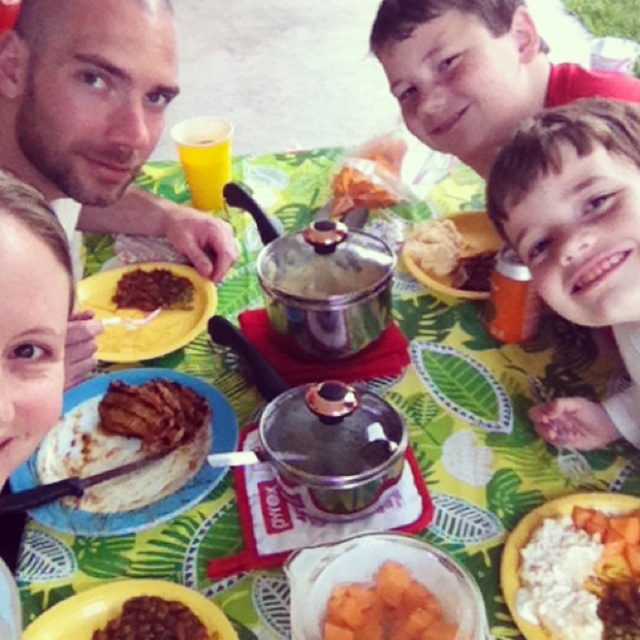
Question: Is white creamy rice at center wider than smooth brown rice at center?

Choices:
 (A) yes
 (B) no

Answer: (B)

Question: Which object is positioned closest to the yellow matte plate at center-left?

Choices:
 (A) smooth brown rice at center
 (B) brown matte chili at center
 (C) brown matte/soft rice cake at center
 (D) white creamy rice at center

Answer: (B)

Question: Estimate the real-world distances between objects in this image. Which object is farther from the brown matte chili at center?

Choices:
 (A) orange matte sweet potato at center
 (B) yellow matte plate at center-left

Answer: (A)

Question: In this image, where is matte black plate at left located relative to dark red glossy chili at center?

Choices:
 (A) right
 (B) left

Answer: (B)

Question: Does brown matte/soft rice cake at center have a smaller size compared to dark red glossy chili at center?

Choices:
 (A) yes
 (B) no

Answer: (B)

Question: Which of the following is the farthest from the observer?

Choices:
 (A) (385, 582)
 (B) (180, 308)
 (C) (100, 307)

Answer: (C)